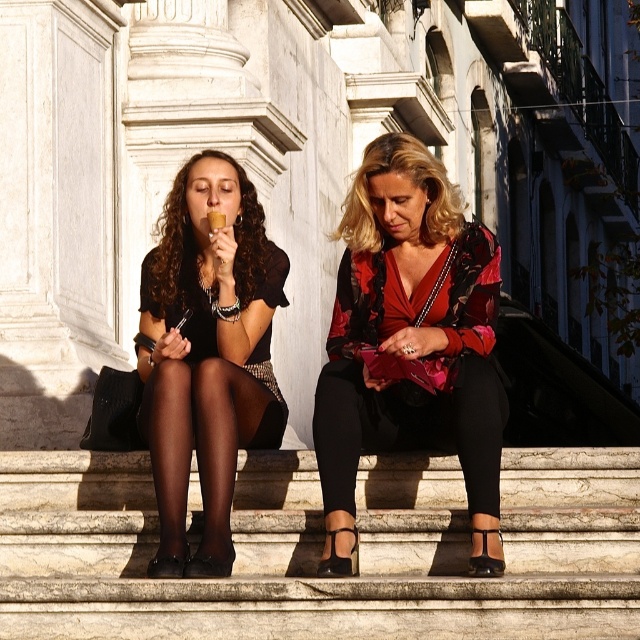
Is shiny red fabric at center below matte black dress at center?

No.

Between shiny red fabric at center and matte black dress at center, which one appears on the left side from the viewer's perspective?

From the viewer's perspective, matte black dress at center appears more on the left side.

Who is more forward, (428, 291) or (250, 227)?

Point (428, 291)

At what (x,y) coordinates should I click in order to perform the action: click on shiny red fabric at center. Please return your answer as a coordinate pair (x, y). This screenshot has height=640, width=640. Looking at the image, I should click on (410, 344).